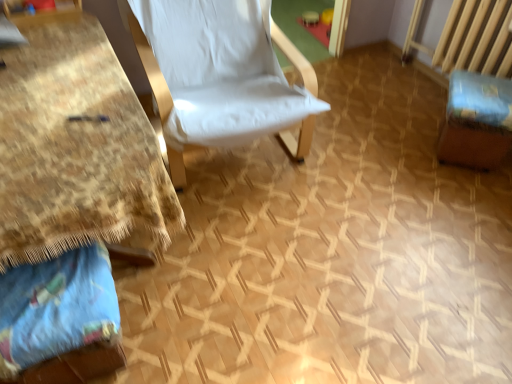
Question: Is blue cotton pillow at lower left next to brown fabric swivel chair at right and touching it?

Choices:
 (A) no
 (B) yes

Answer: (A)

Question: From the image's perspective, is blue cotton pillow at lower left on brown fabric swivel chair at right?

Choices:
 (A) no
 (B) yes

Answer: (A)

Question: Is blue cotton pillow at lower left not within brown fabric swivel chair at right?

Choices:
 (A) no
 (B) yes

Answer: (B)

Question: Can you confirm if blue cotton pillow at lower left is shorter than brown fabric swivel chair at right?

Choices:
 (A) no
 (B) yes

Answer: (B)

Question: From a real-world perspective, is blue cotton pillow at lower left located beneath brown fabric swivel chair at right?

Choices:
 (A) no
 (B) yes

Answer: (B)

Question: In terms of height, does white fabric chair at center look taller or shorter compared to brown fabric swivel chair at right?

Choices:
 (A) tall
 (B) short

Answer: (A)

Question: Do you think white fabric chair at center is within brown fabric swivel chair at right, or outside of it?

Choices:
 (A) inside
 (B) outside

Answer: (B)

Question: In terms of size, does white fabric chair at center appear bigger or smaller than brown fabric swivel chair at right?

Choices:
 (A) big
 (B) small

Answer: (A)

Question: From the image's perspective, is white fabric chair at center above or below brown fabric swivel chair at right?

Choices:
 (A) above
 (B) below

Answer: (A)

Question: From the image's perspective, is brown fabric swivel chair at right located above or below blue cotton pillow at lower left?

Choices:
 (A) above
 (B) below

Answer: (A)

Question: Does point (449, 135) appear closer or farther from the camera than point (19, 337)?

Choices:
 (A) closer
 (B) farther

Answer: (B)

Question: Looking at their shapes, would you say brown fabric swivel chair at right is wider or thinner than blue cotton pillow at lower left?

Choices:
 (A) wide
 (B) thin

Answer: (A)

Question: Based on their sizes in the image, would you say brown fabric swivel chair at right is bigger or smaller than blue cotton pillow at lower left?

Choices:
 (A) small
 (B) big

Answer: (B)

Question: Is brown fabric swivel chair at right to the left or to the right of white fabric chair at center in the image?

Choices:
 (A) left
 (B) right

Answer: (B)

Question: Considering their positions, is brown fabric swivel chair at right located in front of or behind white fabric chair at center?

Choices:
 (A) front
 (B) behind

Answer: (B)